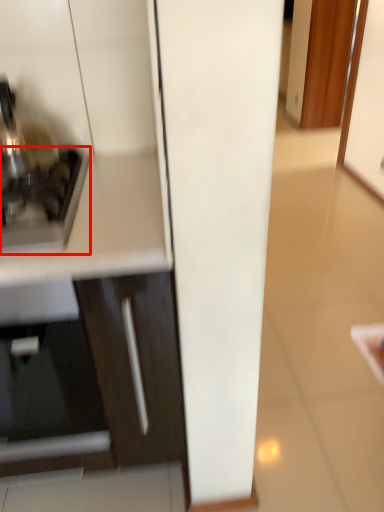
Question: From the image's perspective, what is the correct spatial positioning of home appliance (annotated by the red box) in reference to cabinetry?

Choices:
 (A) below
 (B) above

Answer: (B)